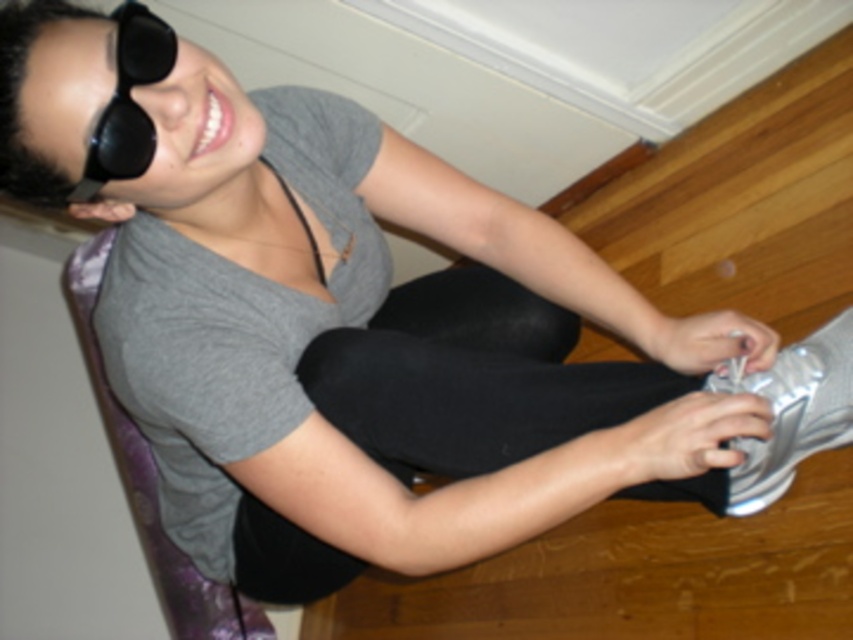
You are a fashion designer observing the image and need to decide which item to place in a display case. The case has limited space. Based on the size of the matte gray shirt at upper left and the black matte sunglasses at upper left, which item should you prioritize placing first?

The matte gray shirt at upper left is bigger than the black matte sunglasses at upper left, so you should prioritize placing the matte gray shirt at upper left first to accommodate its larger size in the display case.

You are a fashion designer observing the image. You need to determine which item is narrower between the matte gray shirt at upper left and the black matte leggings at center. Which one is it?

The matte gray shirt at upper left is thinner than the black matte leggings at center, so the matte gray shirt at upper left is narrower.